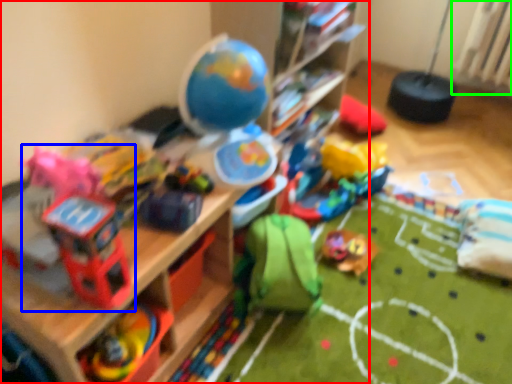
Question: Considering the real-world distances, which object is farthest from shelf (highlighted by a red box)? toy (highlighted by a blue box) or radiator (highlighted by a green box)?

Choices:
 (A) toy
 (B) radiator

Answer: (B)